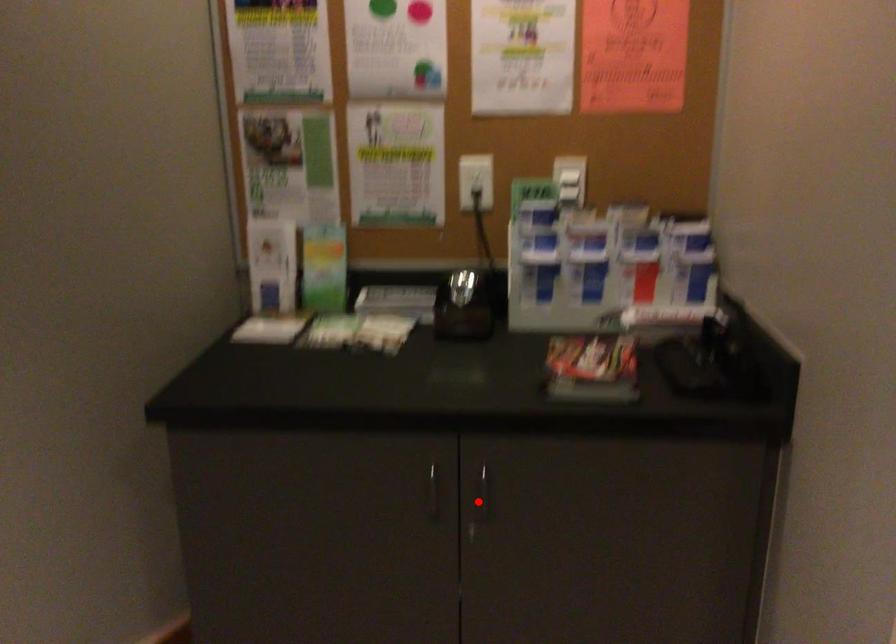
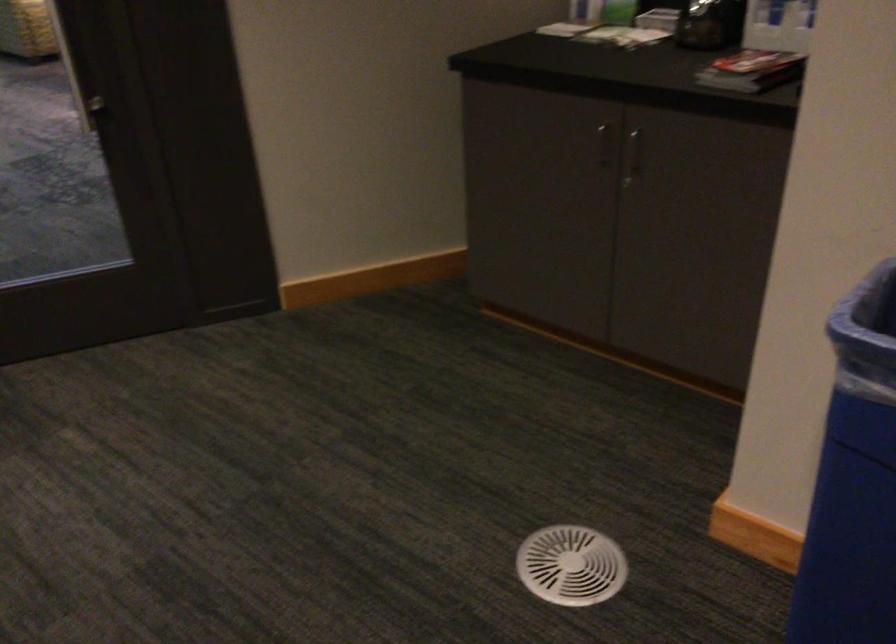
Locate, in the second image, the point that corresponds to the highlighted location in the first image.

(633, 155)